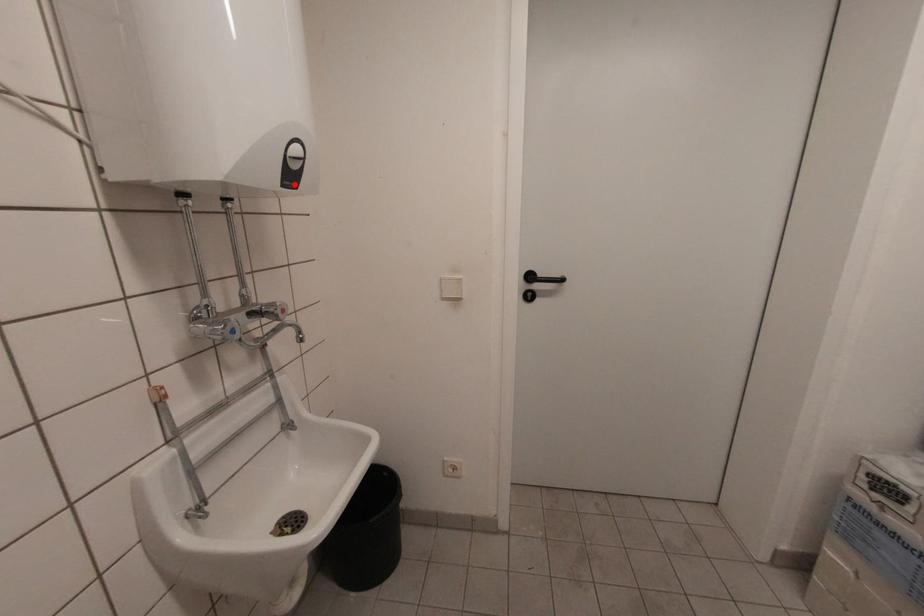
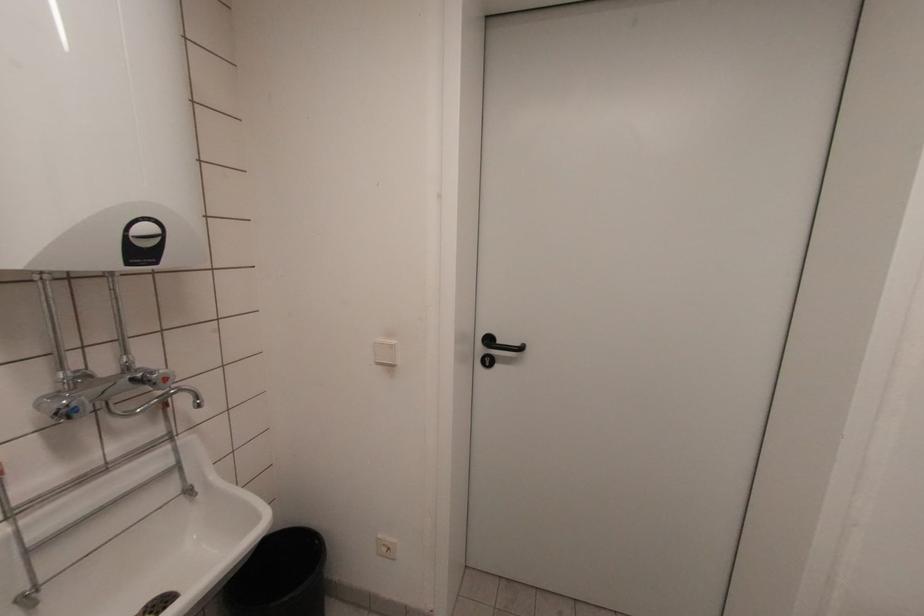
The point at the highlighted location is marked in the first image. Where is the corresponding point in the second image?

(151, 261)